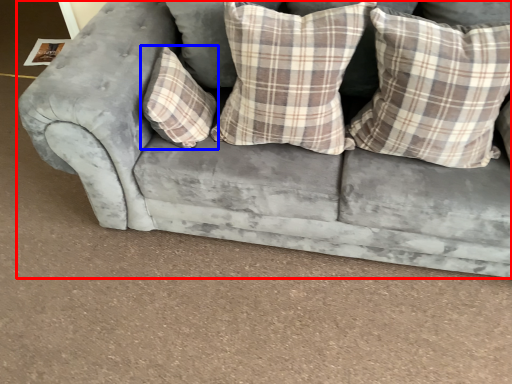
Question: Which of the following is the farthest to the observer, studio couch (highlighted by a red box) or pillow (highlighted by a blue box)?

Choices:
 (A) studio couch
 (B) pillow

Answer: (B)